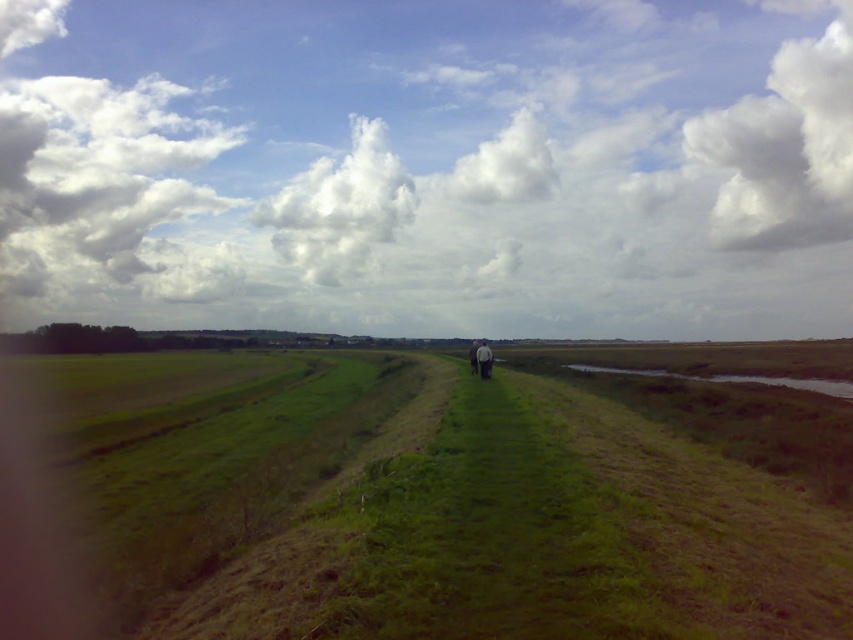
Question: Can you confirm if green grassy path at center is positioned above white fabric couple at center?

Choices:
 (A) no
 (B) yes

Answer: (A)

Question: Which object is closer to the camera taking this photo?

Choices:
 (A) green grassy path at center
 (B) white fabric couple at center

Answer: (A)

Question: Can you confirm if green grassy path at center is positioned to the left of white fabric couple at center?

Choices:
 (A) yes
 (B) no

Answer: (A)

Question: Which point is farther from the camera taking this photo?

Choices:
 (A) (480, 348)
 (B) (357, 556)

Answer: (A)

Question: Which of the following is the closest to the observer?

Choices:
 (A) green grassy path at center
 (B) white fabric couple at center

Answer: (A)

Question: Is green grassy path at center to the right of white fabric couple at center from the viewer's perspective?

Choices:
 (A) no
 (B) yes

Answer: (A)